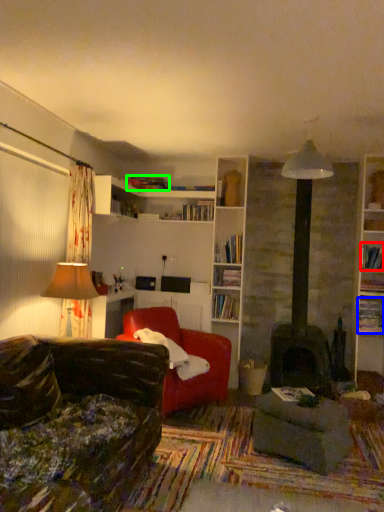
Question: Which object is positioned farthest from book (highlighted by a red box)? Select from book (highlighted by a blue box) and book (highlighted by a green box).

Choices:
 (A) book
 (B) book

Answer: (B)